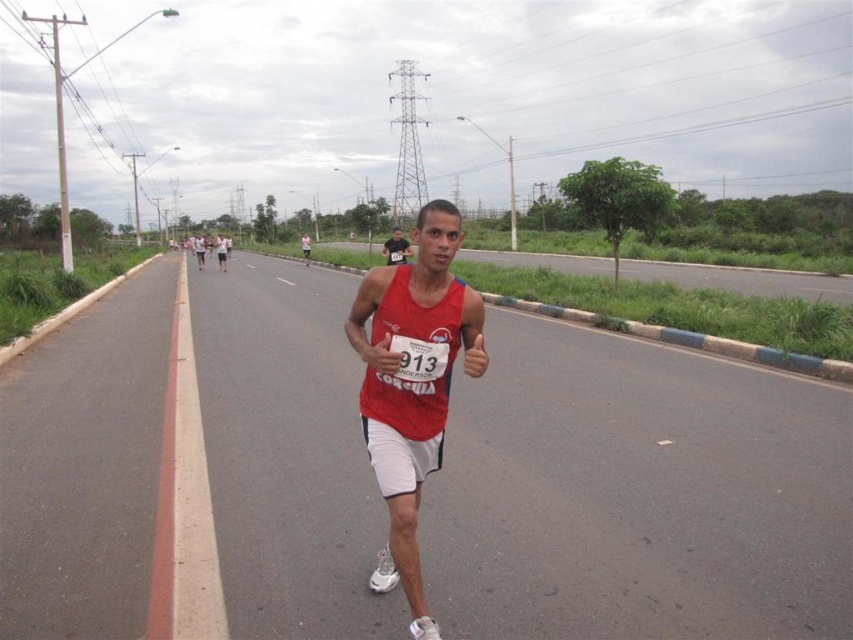
You are a runner participating in a marathon and you see the red matte tank top at center and the matte red tank top at center. Which one is closer to you?

Both the red matte tank top at center and the matte red tank top at center are the same object, so they are at the same distance from you.

You are a photographer at the marathon event. You want to take a photo that includes both the point at (419, 237) and the point at (395, 230). Which point should you focus on first to ensure both are in sharp focus?

You should focus on point (395, 230) first because it is further away from the camera compared to point (419, 237). By focusing on the farther point, the closer point will also be within the depth of field, ensuring both are in sharp focus.